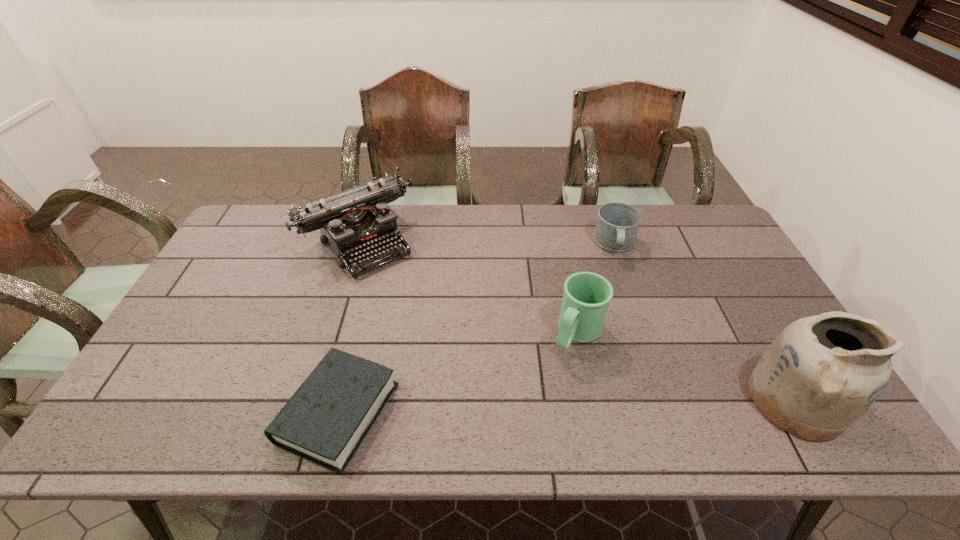
This screenshot has height=540, width=960. Find the location of `free spot on the desktop that is between the Bible and the rightmost object and is positioned on the side of the third object from left to right with the handle`. free spot on the desktop that is between the Bible and the rightmost object and is positioned on the side of the third object from left to right with the handle is located at coordinates (523, 407).

Where is `vacant space on the desktop that is between the shortest object and the pottery and is positioned on the keyboard of the typewriter`? The image size is (960, 540). vacant space on the desktop that is between the shortest object and the pottery and is positioned on the keyboard of the typewriter is located at coordinates (507, 408).

At what (x,y) coordinates should I click in order to perform the action: click on free spot on the desktop that is between the Bible and the rightmost object and is positioned on the side of the farther mug with the handle. Please return your answer as a coordinate pair (x, y). Looking at the image, I should click on (627, 404).